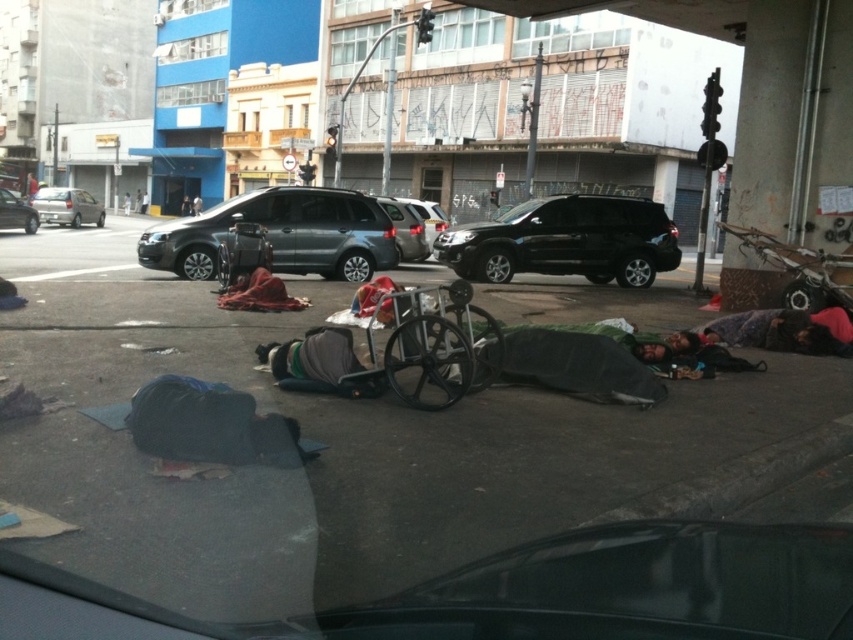
You are a delivery driver who needs to deliver a package to the blue fabric sleeping bag at lower left. The GPS shows that the blue fabric sleeping bag at lower left is located at point (209, 424). If you are currently at point 0.5, 0.5, which direction should you move your car to reach the blue fabric sleeping bag at lower left?

The blue fabric sleeping bag at lower left is located at point (209, 424). Since you are at point 0.5, 0.5, you need to move your car to the right and down to reach the blue fabric sleeping bag at lower left.